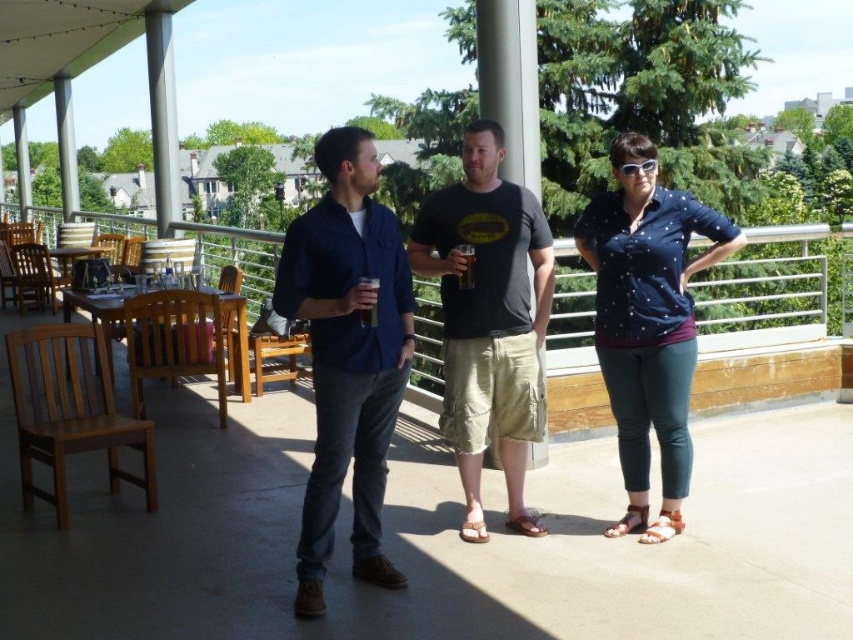
You are a photographer trying to capture a clear shot of the translucent glass at center. However, the navy blue shirt at center is blocking your view. Can you adjust your angle to see the glass without the shirt obscuring it?

The navy blue shirt at center is positioned under the translucent glass at center, so adjusting your angle slightly upward might allow you to see the translucent glass at center without the shirt blocking the view.

You are organizing a clothing donation drive and need to categorize shirts by size. You have two shirts in front of you, the matte blue shirt at center and the navy blue shirt at center. Which one should you place in the large size bin?

The matte blue shirt at center should be placed in the large size bin because it has a larger size compared to the navy blue shirt at center.

What is located at the coordinates point (x=488, y=320)?

The dark gray t shirt at center is located at point (x=488, y=320).